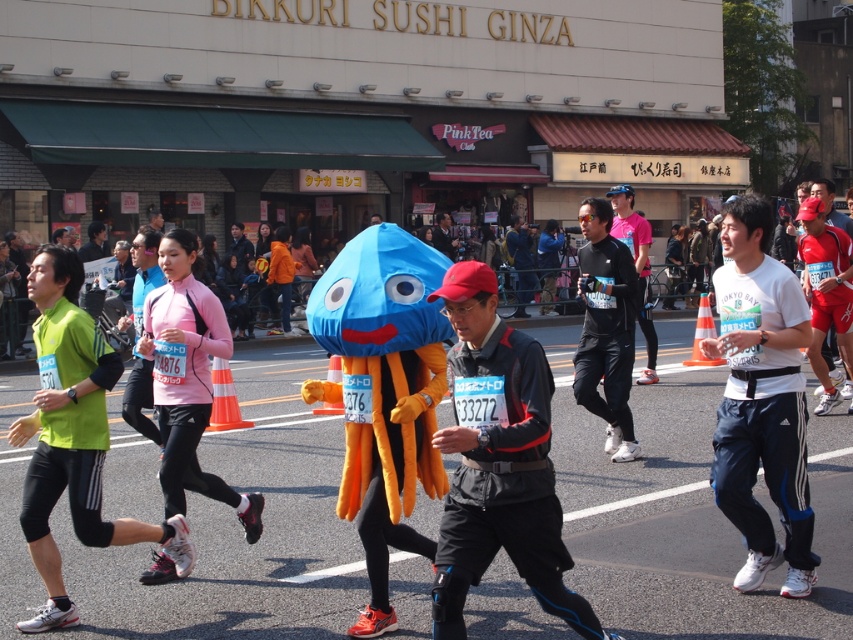
Which is above, dark gray/charcoal fabric jacket at center or green fabric running outfit at left?

green fabric running outfit at left is higher up.

Does dark gray/charcoal fabric jacket at center appear over green fabric running outfit at left?

Incorrect, dark gray/charcoal fabric jacket at center is not positioned above green fabric running outfit at left.

Is point (450, 273) farther from viewer compared to point (57, 333)?

No, it is not.

What are the coordinates of `dark gray/charcoal fabric jacket at center` in the screenshot? It's located at (498, 461).

Is green fabric running outfit at left bigger than pink matte running suit at left?

Incorrect, green fabric running outfit at left is not larger than pink matte running suit at left.

Which is more to the right, green fabric running outfit at left or pink matte running suit at left?

pink matte running suit at left

Between point (91, 323) and point (218, 488), which one is positioned behind?

Point (218, 488)

At what (x,y) coordinates should I click in order to perform the action: click on green fabric running outfit at left. Please return your answer as a coordinate pair (x, y). The image size is (853, 640). Looking at the image, I should click on pyautogui.click(x=73, y=436).

Who is more forward, (741, 500) or (99, 342)?

Positioned in front is point (99, 342).

Can you confirm if white adidas track pants at center is positioned to the left of green fabric running outfit at left?

Incorrect, white adidas track pants at center is not on the left side of green fabric running outfit at left.

Which is in front, point (730, 202) or point (30, 435)?

Point (30, 435)

Find the location of a particular element. The height and width of the screenshot is (640, 853). white adidas track pants at center is located at coordinates (761, 400).